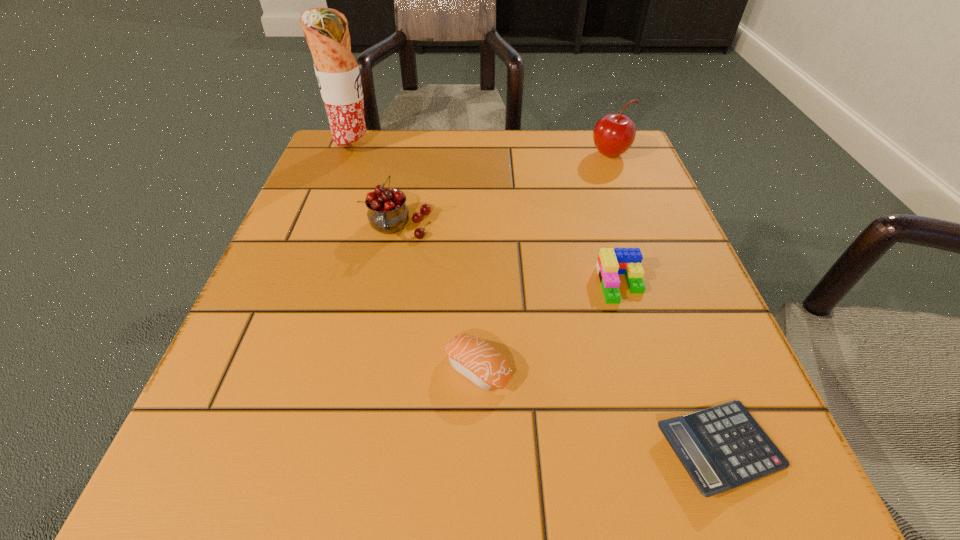
At what (x,y) coordinates should I click in order to perform the action: click on the tallest object. Please return your answer as a coordinate pair (x, y). Image resolution: width=960 pixels, height=540 pixels. Looking at the image, I should click on (326, 30).

The width and height of the screenshot is (960, 540). In order to click on burrito in this screenshot , I will do `click(326, 30)`.

The width and height of the screenshot is (960, 540). I want to click on the right cherry, so click(x=613, y=134).

Where is `the nearer cherry`? This screenshot has height=540, width=960. the nearer cherry is located at coordinates (387, 213).

You are a GUI agent. You are given a task and a screenshot of the screen. Output one action in this format:
    pyautogui.click(x=<x>, y=<y>)
    Task: Click on the fifth object from right to left
    
    Given the screenshot: What is the action you would take?
    pyautogui.click(x=387, y=213)

Locate an element on the screen. The width and height of the screenshot is (960, 540). Lego is located at coordinates (611, 261).

You are a GUI agent. You are given a task and a screenshot of the screen. Output one action in this format:
    pyautogui.click(x=<x>, y=<y>)
    Task: Click on the third object from left to right
    This screenshot has width=960, height=540.
    Given the screenshot: What is the action you would take?
    pyautogui.click(x=476, y=360)

The image size is (960, 540). Identify the location of the fifth farthest object. (476, 360).

Find the location of a particular element. The height and width of the screenshot is (540, 960). the shortest object is located at coordinates (722, 447).

Locate an element on the screen. The height and width of the screenshot is (540, 960). the nearest object is located at coordinates (722, 447).